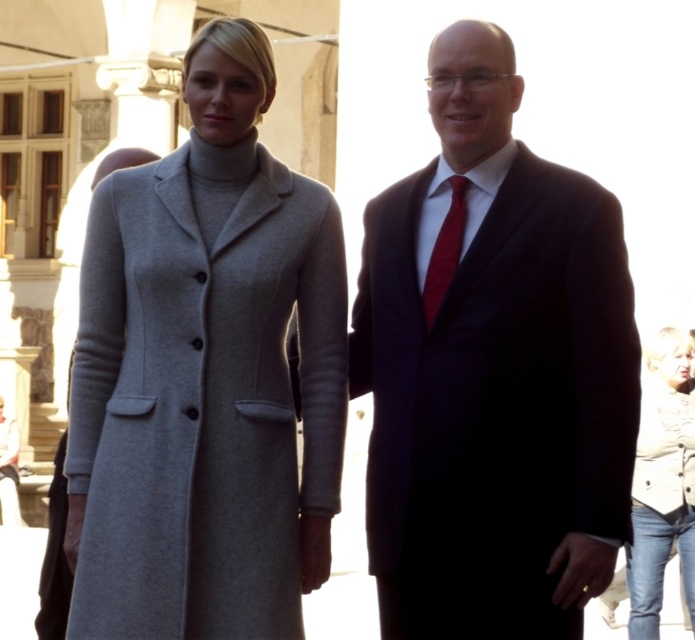
Is gray wool coat at left wider than red silk tie at center?

Yes.

Does gray wool coat at left have a lesser width compared to red silk tie at center?

No.

The width and height of the screenshot is (695, 640). What do you see at coordinates (202, 403) in the screenshot?
I see `gray wool coat at left` at bounding box center [202, 403].

Locate an element on the screen. This screenshot has width=695, height=640. gray wool coat at left is located at coordinates (202, 403).

Which is more to the left, gray wool coat at left or denim jacket at lower right?

Positioned to the left is gray wool coat at left.

You are a GUI agent. You are given a task and a screenshot of the screen. Output one action in this format:
    pyautogui.click(x=<x>, y=<y>)
    Task: Click on the gray wool coat at left
    The width and height of the screenshot is (695, 640).
    Given the screenshot: What is the action you would take?
    pyautogui.click(x=202, y=403)

The width and height of the screenshot is (695, 640). In order to click on gray wool coat at left in this screenshot , I will do 202,403.

Between point (521, 589) and point (8, 436), which one is positioned in front?

Point (521, 589) is more forward.

Where is `matte black suit at center`? matte black suit at center is located at coordinates (493, 374).